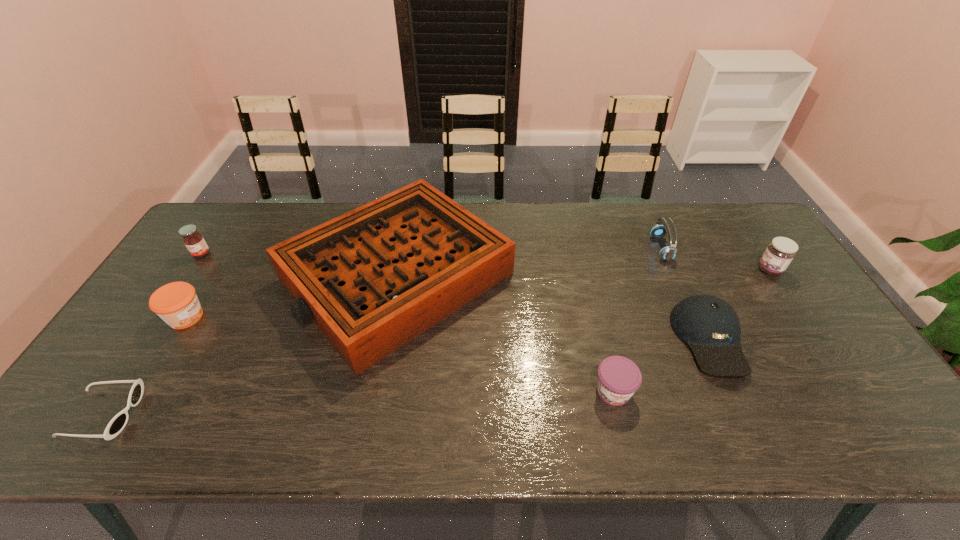
Where is `free region located on the front label of the third jam from left to right`? Image resolution: width=960 pixels, height=540 pixels. free region located on the front label of the third jam from left to right is located at coordinates (623, 430).

Image resolution: width=960 pixels, height=540 pixels. What are the coordinates of `vacant area situated 0.060m with the lenses of the shortest object facing outward` in the screenshot? It's located at (161, 414).

Where is `gameboard that is at the far edge`? gameboard that is at the far edge is located at coordinates (372, 279).

Find the location of a particular element. headset present at the far edge is located at coordinates (668, 253).

You are a GUI agent. You are given a task and a screenshot of the screen. Output one action in this format:
    pyautogui.click(x=<x>, y=<y>)
    Task: Click on the object that is positioned at the near edge
    
    Given the screenshot: What is the action you would take?
    pyautogui.click(x=117, y=424)

The height and width of the screenshot is (540, 960). What are the coordinates of `sunglasses at the left edge` in the screenshot? It's located at (117, 424).

Where is `object that is at the right edge`? object that is at the right edge is located at coordinates (780, 252).

Where is `object located at the near left corner`? Image resolution: width=960 pixels, height=540 pixels. object located at the near left corner is located at coordinates (117, 424).

In the image, there is a desktop. Identify the location of free space at the far edge. This screenshot has width=960, height=540. (467, 204).

In the image, there is a desktop. At what (x,y) coordinates should I click in order to perform the action: click on vacant space at the near edge. Please return your answer as a coordinate pair (x, y). The height and width of the screenshot is (540, 960). Looking at the image, I should click on (689, 411).